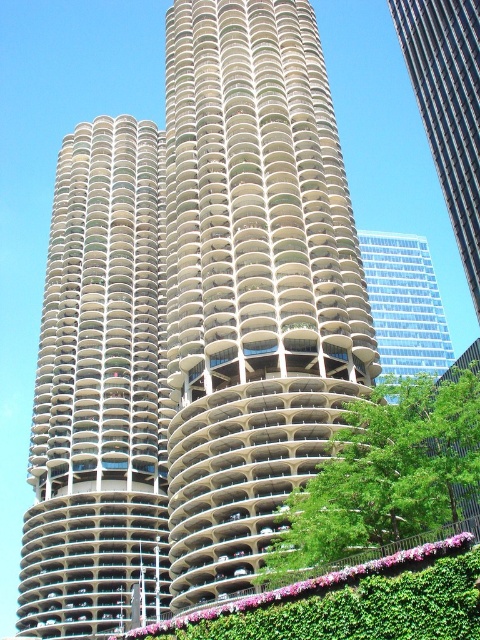
Between point (314, 484) and point (440, 340), which one is positioned in front?

Point (314, 484) is more forward.

Which is behind, point (374, 484) or point (372, 232)?

Positioned behind is point (372, 232).

Where is `green leafy tree at lower right`? green leafy tree at lower right is located at coordinates (384, 476).

Measure the distance between point (156, 337) and camera.

The distance of point (156, 337) from camera is 103.06 meters.

Between beige concrete tower at center and green leafy tree at lower right, which one has more height?

With more height is beige concrete tower at center.

Between point (34, 401) and point (285, 579), which one is positioned in front?

Point (285, 579) is more forward.

Locate an element on the screen. Image resolution: width=480 pixels, height=640 pixels. beige concrete tower at center is located at coordinates (99, 392).

Is beige concrete building at center smaller than green leafy tree at lower right?

Actually, beige concrete building at center might be larger than green leafy tree at lower right.

Does point (310, 12) come farther from viewer compared to point (408, 458)?

Yes, point (310, 12) is behind point (408, 458).

Is point (217, 257) positioned after point (303, 496)?

That is True.

At what (x,y) coordinates should I click in order to perform the action: click on beige concrete building at center. Please return your answer as a coordinate pair (x, y). Looking at the image, I should click on (252, 282).